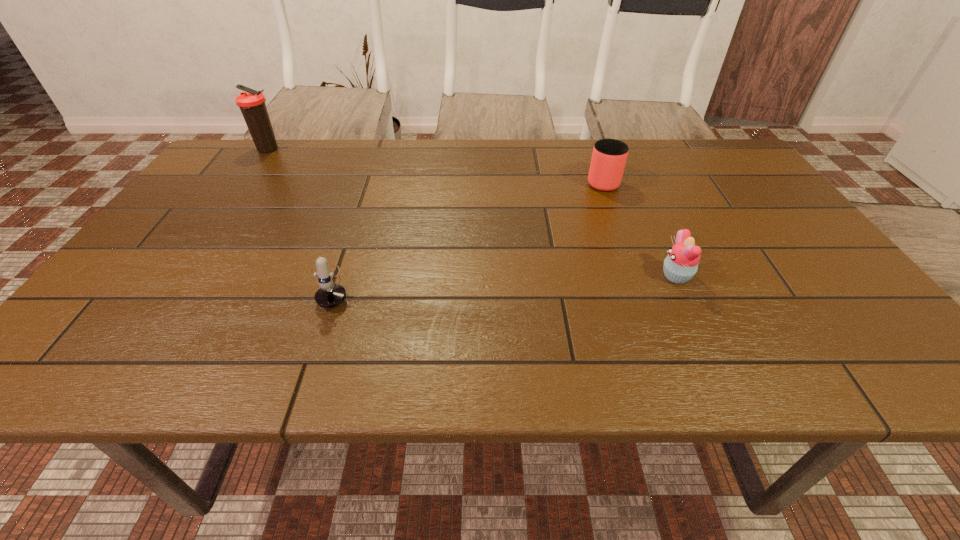
Locate an element on the screen. The height and width of the screenshot is (540, 960). free space located on the left of the microphone is located at coordinates pos(143,287).

This screenshot has height=540, width=960. What are the coordinates of `free point located 0.090m on the face of the rightmost object` in the screenshot? It's located at (620, 275).

Find the location of `vacant space situated 0.370m on the face of the rightmost object`. vacant space situated 0.370m on the face of the rightmost object is located at coordinates (493, 275).

Locate an element on the screen. free spot located on the face of the rightmost object is located at coordinates (602, 275).

The width and height of the screenshot is (960, 540). What are the coordinates of `thermos bottle situated at the far edge` in the screenshot? It's located at (252, 104).

What are the coordinates of `cup present at the far edge` in the screenshot? It's located at (609, 156).

Locate an element on the screen. The height and width of the screenshot is (540, 960). object located in the left edge section of the desktop is located at coordinates (252, 104).

The width and height of the screenshot is (960, 540). I want to click on object that is at the far left corner, so click(x=252, y=104).

Image resolution: width=960 pixels, height=540 pixels. In order to click on vacant space at the far edge of the desktop in this screenshot , I will do `click(525, 140)`.

In the image, there is a desktop. Identify the location of vacant space at the near edge. (500, 356).